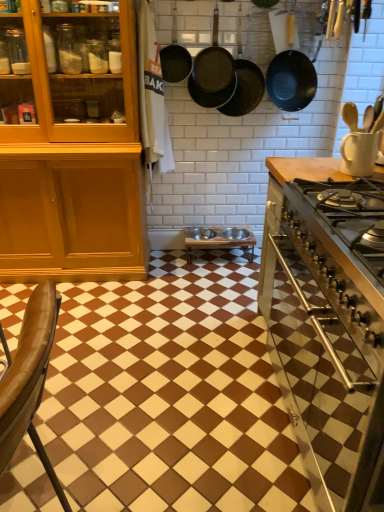
Find the location of a particular element. This screenshot has height=512, width=384. vacant space in front of wooden table at center is located at coordinates (220, 279).